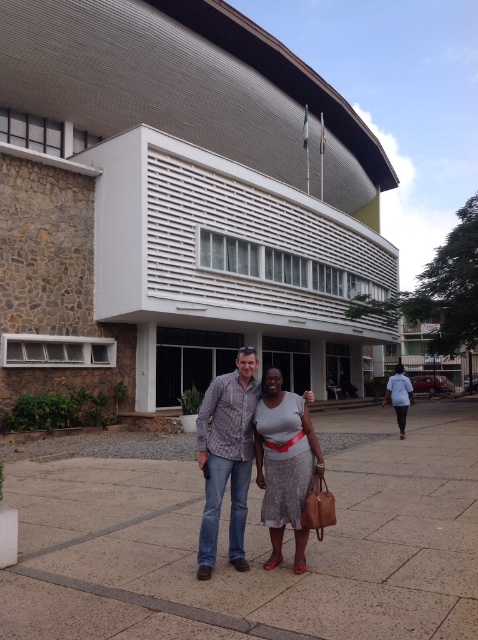
Is point (299, 460) positioned after point (405, 419)?

No, it is not.

Identify the location of silver metallic dress at center. (284, 465).

This screenshot has height=640, width=478. Identify the location of silver metallic dress at center. (284, 465).

Is plaid shirt at center shorter than silver metallic dress at center?

No, plaid shirt at center is not shorter than silver metallic dress at center.

Is plaid shirt at center to the left of silver metallic dress at center from the viewer's perspective?

Correct, you'll find plaid shirt at center to the left of silver metallic dress at center.

What do you see at coordinates (227, 458) in the screenshot? This screenshot has height=640, width=478. I see `plaid shirt at center` at bounding box center [227, 458].

Identify the location of plaid shirt at center. Image resolution: width=478 pixels, height=640 pixels. (227, 458).

Is plaid shirt at center closer to the viewer compared to light blue fabric at center?

That is True.

Who is higher up, plaid shirt at center or light blue fabric at center?

plaid shirt at center

Describe the element at coordinates (227, 458) in the screenshot. This screenshot has height=640, width=478. I see `plaid shirt at center` at that location.

The width and height of the screenshot is (478, 640). I want to click on plaid shirt at center, so click(x=227, y=458).